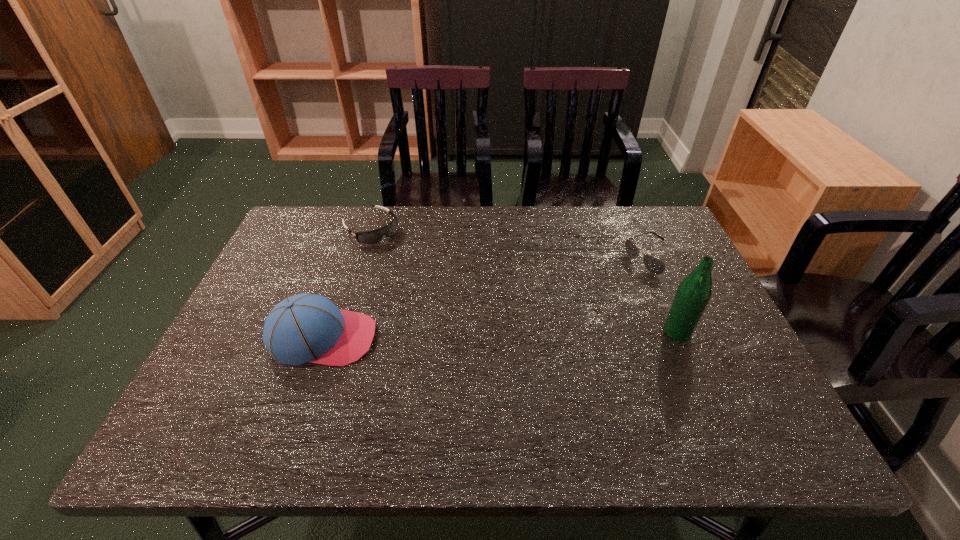
At what (x,y) coordinates should I click in order to perform the action: click on vacant space that is in between the tallest object and the goggles. Please return your answer as a coordinate pair (x, y). The width and height of the screenshot is (960, 540). Looking at the image, I should click on (524, 280).

Locate an element on the screen. The width and height of the screenshot is (960, 540). free spot between the goggles and the baseball cap is located at coordinates (x=347, y=284).

This screenshot has width=960, height=540. I want to click on unoccupied area between the goggles and the tallest object, so tap(524, 280).

Where is `object that is the closest to the bottle`? The height and width of the screenshot is (540, 960). object that is the closest to the bottle is located at coordinates (655, 266).

Locate which object ranks in proximity to the sunglasses. Please provide its 2D coordinates. Your answer should be formatted as a tuple, i.e. [(x, y)], where the tuple contains the x and y coordinates of a point satisfying the conditions above.

[(694, 292)]